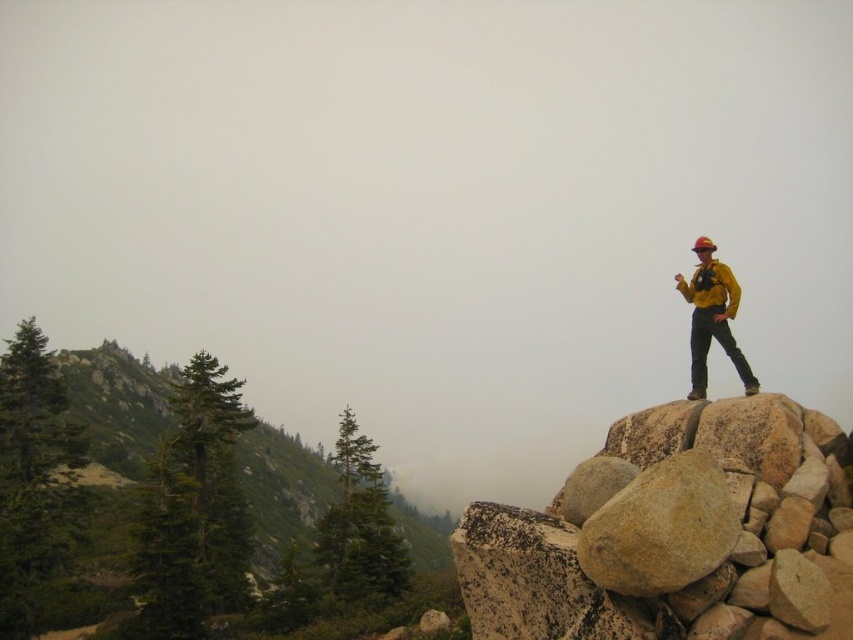
Question: Is yellowish-brown granite boulder at upper right thinner than green matte pine at left?

Choices:
 (A) yes
 (B) no

Answer: (A)

Question: Among these objects, which one is nearest to the camera?

Choices:
 (A) green textured trees at left
 (B) yellowish-brown granite boulder at upper right
 (C) green matte pine at left

Answer: (B)

Question: Which point appears closest to the camera in this image?

Choices:
 (A) (36, 464)
 (B) (730, 529)
 (C) (316, 484)

Answer: (B)

Question: Where is yellowish-brown granite boulder at upper right located in relation to smooth beige rock at center in the image?

Choices:
 (A) right
 (B) left

Answer: (A)

Question: Which of the following is the farthest from the observer?

Choices:
 (A) green matte pine at left
 (B) smooth beige rock at center

Answer: (A)

Question: In this image, where is yellowish-brown granite boulder at upper right located relative to green textured trees at left?

Choices:
 (A) right
 (B) left

Answer: (A)